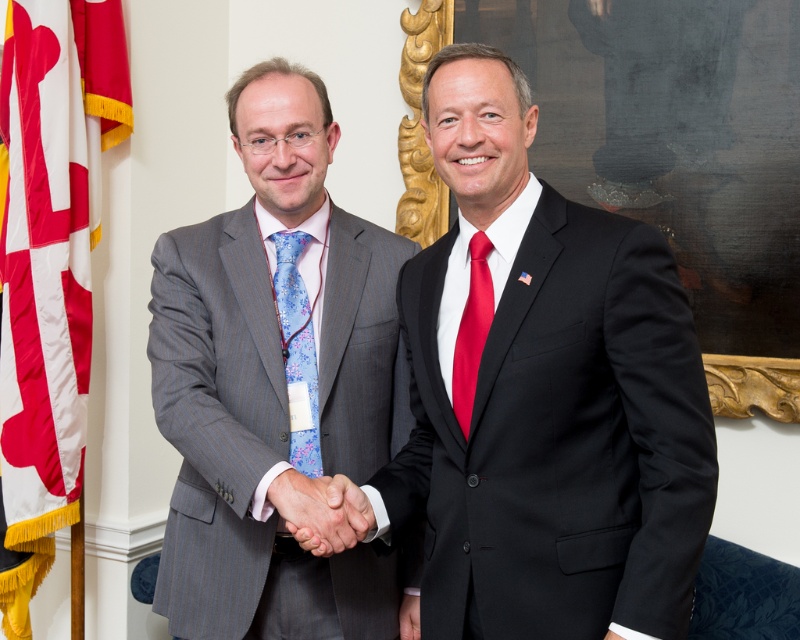
Question: Which object appears farthest from the camera in this image?

Choices:
 (A) matte black hands at center
 (B) red satin tie at center

Answer: (A)

Question: Which point is closer to the camera?

Choices:
 (A) red satin tie at center
 (B) blue floral silk tie at center

Answer: (A)

Question: Among these points, which one is farthest from the camera?

Choices:
 (A) (42, 342)
 (B) (300, 134)
 (C) (684, 614)
 (D) (420, 109)

Answer: (D)

Question: Can you confirm if matte black suit at right is wider than white satin flag at left?

Choices:
 (A) yes
 (B) no

Answer: (A)

Question: Can you confirm if matte black suit at right is positioned above blue floral silk tie at center?

Choices:
 (A) no
 (B) yes

Answer: (B)

Question: Is matte black suit at right positioned at the back of matte black hands at center?

Choices:
 (A) no
 (B) yes

Answer: (A)